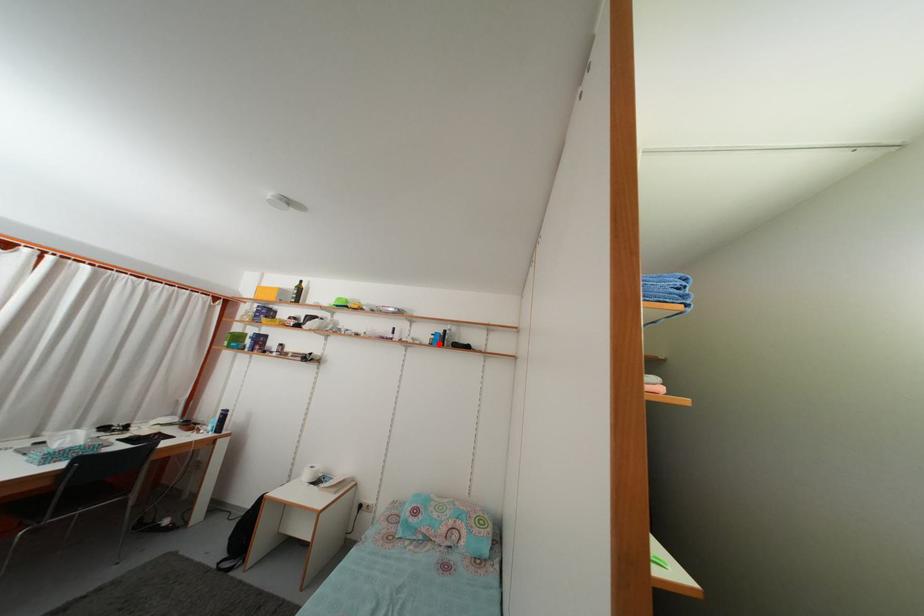
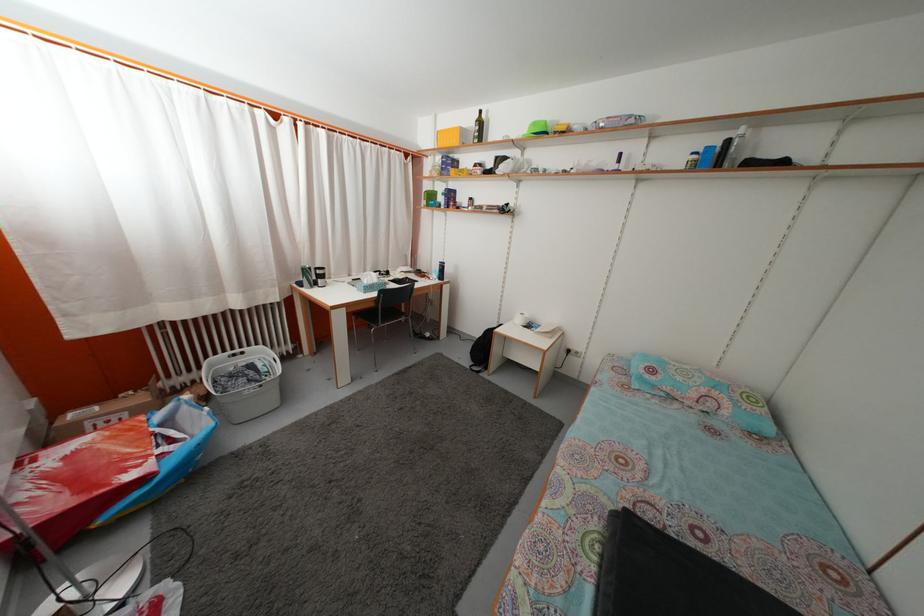
Find the pixel in the second image that matches the highlighted location in the first image.

(699, 164)